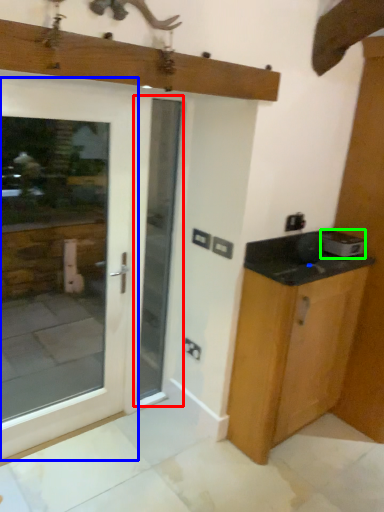
Question: Based on their relative distances, which object is nearer to screen door (highlighted by a red box)? Choose from door (highlighted by a blue box) and appliance (highlighted by a green box).

Choices:
 (A) door
 (B) appliance

Answer: (B)